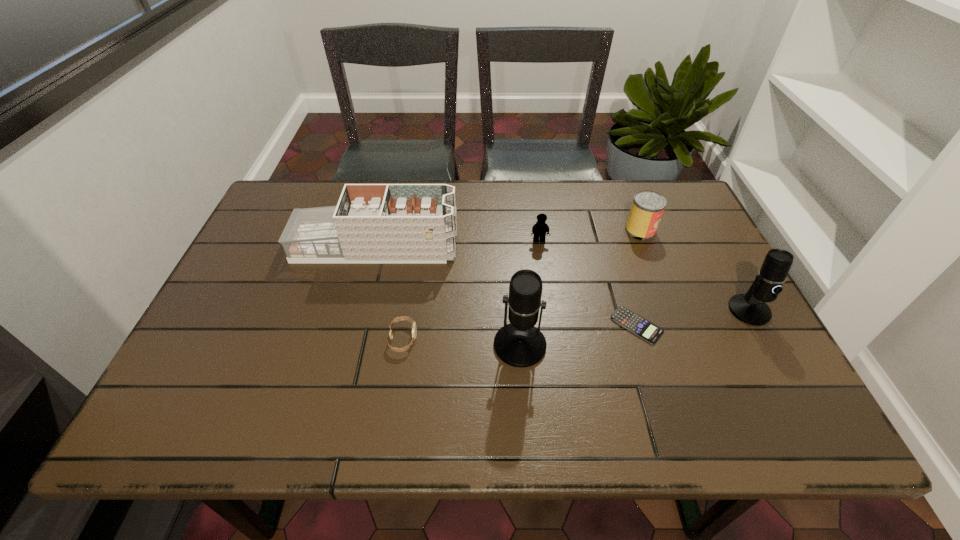
The width and height of the screenshot is (960, 540). In order to click on vacant spot to place a microphone on the left in this screenshot , I will do `click(255, 386)`.